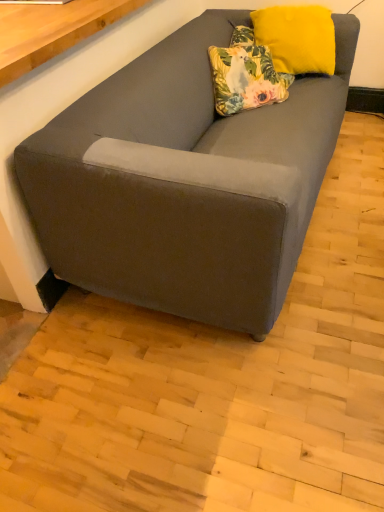
Find the location of `yellow velvet pillow at upper right, marked as the 1th pillow in a right-to-left arrangement`. yellow velvet pillow at upper right, marked as the 1th pillow in a right-to-left arrangement is located at coordinates (297, 38).

Find the location of a particular element. Image resolution: width=384 pixels, height=512 pixels. floral fabric pillow at upper center, the second pillow viewed from the right is located at coordinates (245, 74).

Considering the positions of point (343, 49) and point (318, 68), is point (343, 49) closer or farther from the camera than point (318, 68)?

Point (343, 49) is positioned farther from the camera compared to point (318, 68).

Which of these two, suede gray couch at lower left or yellow velvet pillow at upper right, marked as the 1th pillow in a right-to-left arrangement, stands taller?

suede gray couch at lower left is taller.

Who is more distant, suede gray couch at lower left or yellow velvet pillow at upper right, the second pillow from the left?

yellow velvet pillow at upper right, the second pillow from the left, is behind.

The height and width of the screenshot is (512, 384). I want to click on studio couch below the yellow velvet pillow at upper right, marked as the 1th pillow in a right-to-left arrangement (from the image's perspective), so click(x=185, y=182).

Does point (184, 189) come farther from viewer compared to point (264, 70)?

No.

Does suede gray couch at lower left turn towards floral fabric pillow at upper center, the second pillow viewed from the right?

Yes, suede gray couch at lower left is turned towards floral fabric pillow at upper center, the second pillow viewed from the right.

Is suede gray couch at lower left taller than floral fabric pillow at upper center, positioned as the 1th pillow in left-to-right order?

Indeed, suede gray couch at lower left has a greater height compared to floral fabric pillow at upper center, positioned as the 1th pillow in left-to-right order.

Is yellow velvet pillow at upper right, the second pillow from the left, looking in the opposite direction of suede gray couch at lower left?

No, suede gray couch at lower left is not at the back of yellow velvet pillow at upper right, the second pillow from the left.

Considering the sizes of objects yellow velvet pillow at upper right, the second pillow from the left, and suede gray couch at lower left in the image provided, who is taller, yellow velvet pillow at upper right, the second pillow from the left, or suede gray couch at lower left?

Standing taller between the two is suede gray couch at lower left.

Which is closer to the camera, (288, 27) or (132, 223)?

Point (288, 27) is positioned farther from the camera compared to point (132, 223).

Is yellow velvet pillow at upper right, the second pillow from the left, far away from suede gray couch at lower left?

No, there isn't a large distance between yellow velvet pillow at upper right, the second pillow from the left, and suede gray couch at lower left.

Is point (245, 92) farther from viewer compared to point (75, 196)?

Yes.

Does floral fabric pillow at upper center, the second pillow viewed from the right, appear on the right side of suede gray couch at lower left?

Yes.

Is floral fabric pillow at upper center, positioned as the 1th pillow in left-to-right order, oriented away from suede gray couch at lower left?

Yes, floral fabric pillow at upper center, positioned as the 1th pillow in left-to-right order,'s orientation is away from suede gray couch at lower left.

From a real-world perspective, does floral fabric pillow at upper center, positioned as the 1th pillow in left-to-right order, stand above suede gray couch at lower left?

Correct, in the physical world, floral fabric pillow at upper center, positioned as the 1th pillow in left-to-right order, is higher than suede gray couch at lower left.

From the image's perspective, which one is positioned higher, floral fabric pillow at upper center, the second pillow viewed from the right, or yellow velvet pillow at upper right, the second pillow from the left?

yellow velvet pillow at upper right, the second pillow from the left, is shown above in the image.

Considering the sizes of objects floral fabric pillow at upper center, the second pillow viewed from the right, and yellow velvet pillow at upper right, marked as the 1th pillow in a right-to-left arrangement, in the image provided, who is thinner, floral fabric pillow at upper center, the second pillow viewed from the right, or yellow velvet pillow at upper right, marked as the 1th pillow in a right-to-left arrangement,?

yellow velvet pillow at upper right, marked as the 1th pillow in a right-to-left arrangement.

How different are the orientations of floral fabric pillow at upper center, positioned as the 1th pillow in left-to-right order, and yellow velvet pillow at upper right, the second pillow from the left, in degrees?

The angular difference between floral fabric pillow at upper center, positioned as the 1th pillow in left-to-right order, and yellow velvet pillow at upper right, the second pillow from the left, is 13.8 degrees.

Considering the relative sizes of floral fabric pillow at upper center, positioned as the 1th pillow in left-to-right order, and yellow velvet pillow at upper right, marked as the 1th pillow in a right-to-left arrangement, in the image provided, is floral fabric pillow at upper center, positioned as the 1th pillow in left-to-right order, bigger than yellow velvet pillow at upper right, marked as the 1th pillow in a right-to-left arrangement,?

Actually, floral fabric pillow at upper center, positioned as the 1th pillow in left-to-right order, might be smaller than yellow velvet pillow at upper right, marked as the 1th pillow in a right-to-left arrangement.

How many degrees apart are the facing directions of yellow velvet pillow at upper right, the second pillow from the left, and floral fabric pillow at upper center, the second pillow viewed from the right?

The facing directions of yellow velvet pillow at upper right, the second pillow from the left, and floral fabric pillow at upper center, the second pillow viewed from the right, are 13.8 degrees apart.

From the image's perspective, does yellow velvet pillow at upper right, the second pillow from the left, appear lower than floral fabric pillow at upper center, the second pillow viewed from the right?

No, from the image's perspective, yellow velvet pillow at upper right, the second pillow from the left, is not below floral fabric pillow at upper center, the second pillow viewed from the right.

Is yellow velvet pillow at upper right, the second pillow from the left, spatially inside floral fabric pillow at upper center, positioned as the 1th pillow in left-to-right order, or outside of it?

yellow velvet pillow at upper right, the second pillow from the left, is not inside floral fabric pillow at upper center, positioned as the 1th pillow in left-to-right order, it's outside.

Find the location of a particular element. studio couch below the yellow velvet pillow at upper right, marked as the 1th pillow in a right-to-left arrangement (from the image's perspective) is located at coordinates (185, 182).

In the image, there is a floral fabric pillow at upper center, the second pillow viewed from the right. Where is `studio couch below it (from a real-world perspective)`? The height and width of the screenshot is (512, 384). studio couch below it (from a real-world perspective) is located at coordinates (185, 182).

Looking at the image, which one is located further to yellow velvet pillow at upper right, marked as the 1th pillow in a right-to-left arrangement, floral fabric pillow at upper center, positioned as the 1th pillow in left-to-right order, or suede gray couch at lower left?

The object further to yellow velvet pillow at upper right, marked as the 1th pillow in a right-to-left arrangement, is suede gray couch at lower left.

From the picture: Based on their spatial positions, is yellow velvet pillow at upper right, the second pillow from the left, or suede gray couch at lower left further from floral fabric pillow at upper center, the second pillow viewed from the right?

suede gray couch at lower left.

Based on their spatial positions, is suede gray couch at lower left or yellow velvet pillow at upper right, marked as the 1th pillow in a right-to-left arrangement, closer to floral fabric pillow at upper center, the second pillow viewed from the right?

Among the two, yellow velvet pillow at upper right, marked as the 1th pillow in a right-to-left arrangement, is located nearer to floral fabric pillow at upper center, the second pillow viewed from the right.

Based on the photo, estimate the real-world distances between objects in this image. Which object is further from yellow velvet pillow at upper right, marked as the 1th pillow in a right-to-left arrangement, suede gray couch at lower left or floral fabric pillow at upper center, the second pillow viewed from the right?

suede gray couch at lower left is further to yellow velvet pillow at upper right, marked as the 1th pillow in a right-to-left arrangement.

When comparing their distances from suede gray couch at lower left, does floral fabric pillow at upper center, positioned as the 1th pillow in left-to-right order, or yellow velvet pillow at upper right, the second pillow from the left, seem further?

Based on the image, yellow velvet pillow at upper right, the second pillow from the left, appears to be further to suede gray couch at lower left.

Based on their spatial positions, is yellow velvet pillow at upper right, the second pillow from the left, or floral fabric pillow at upper center, positioned as the 1th pillow in left-to-right order, closer to suede gray couch at lower left?

floral fabric pillow at upper center, positioned as the 1th pillow in left-to-right order, is positioned closer to the anchor suede gray couch at lower left.

The image size is (384, 512). Identify the location of pillow located between suede gray couch at lower left and yellow velvet pillow at upper right, the second pillow from the left, in the left-right direction. (245, 74).